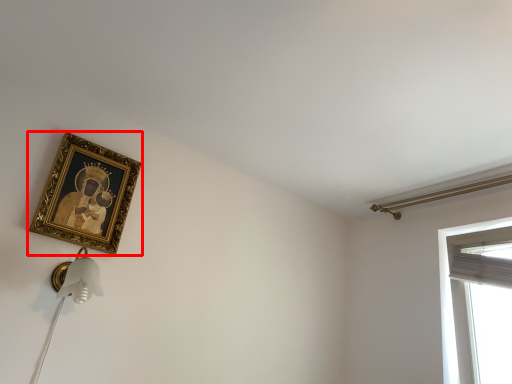
Question: From the image's perspective, what is the correct spatial relationship of picture frame (annotated by the red box) in relation to curtain?

Choices:
 (A) above
 (B) below

Answer: (A)